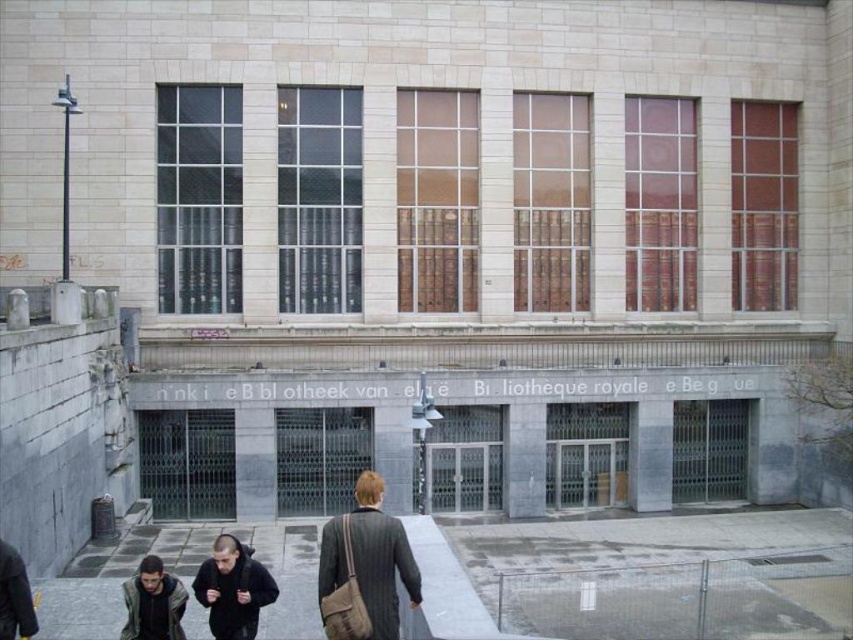
Question: Is striped wool coat at center further to the viewer compared to dark gray jacket at lower left?

Choices:
 (A) no
 (B) yes

Answer: (A)

Question: Among these objects, which one is nearest to the camera?

Choices:
 (A) dark gray fabric jacket at lower center
 (B) dark gray jacket at lower left
 (C) striped wool coat at center

Answer: (C)

Question: Can you confirm if smooth concrete pavement at lower center is smaller than dark gray fabric jacket at lower center?

Choices:
 (A) yes
 (B) no

Answer: (B)

Question: Is striped wool coat at center further to camera compared to dark gray fabric jacket at lower center?

Choices:
 (A) yes
 (B) no

Answer: (B)

Question: Among these objects, which one is nearest to the camera?

Choices:
 (A) smooth concrete pavement at lower center
 (B) striped wool coat at center
 (C) dark gray fabric jacket at lower center

Answer: (A)

Question: Which of the following is the farthest from the observer?

Choices:
 (A) smooth concrete pavement at lower center
 (B) striped wool coat at center

Answer: (B)